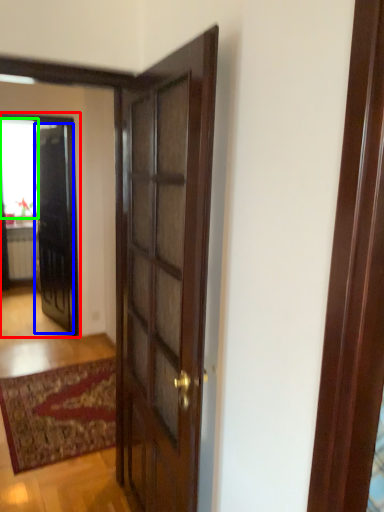
Question: Based on their relative distances, which object is nearer to elevator (highlighted by a red box)? Choose from door (highlighted by a blue box) and window (highlighted by a green box).

Choices:
 (A) door
 (B) window

Answer: (A)